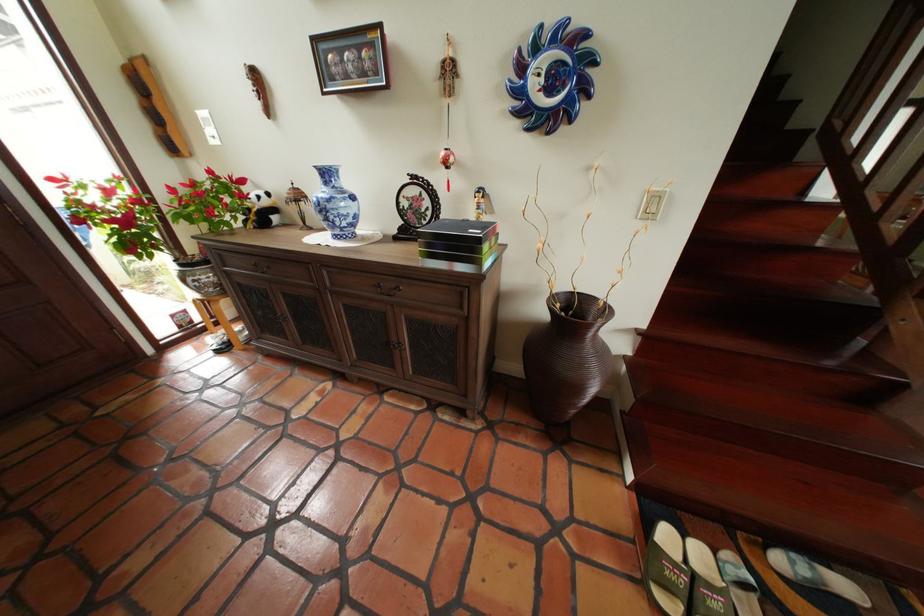
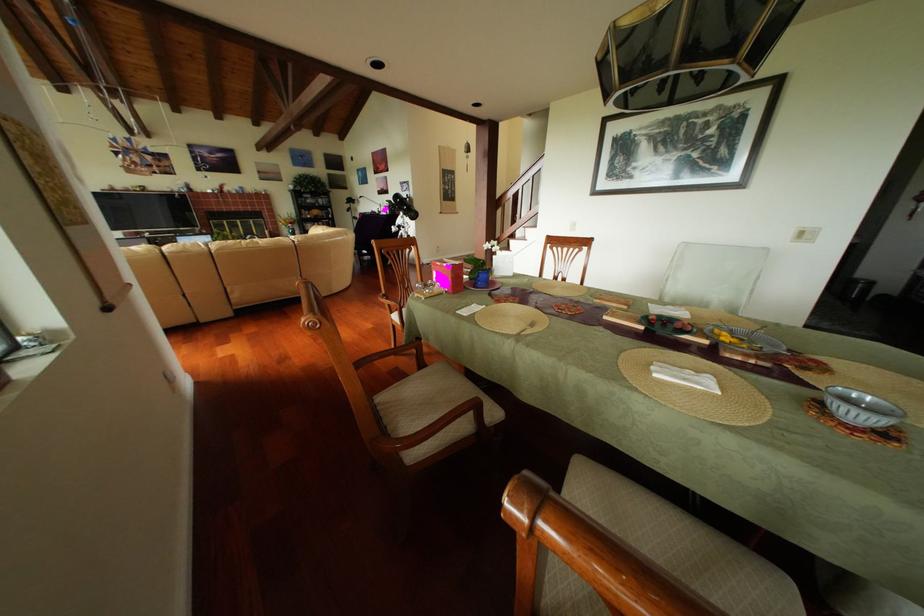
Question: I am providing you with two images of the same scene from different viewpoints. After the viewpoint changes to image2, which objects are now occluded?

Choices:
 (A) cabinet door handle
 (B) pink stool
 (C) pink gift box
 (D) grey patterned bowl

Answer: (A)